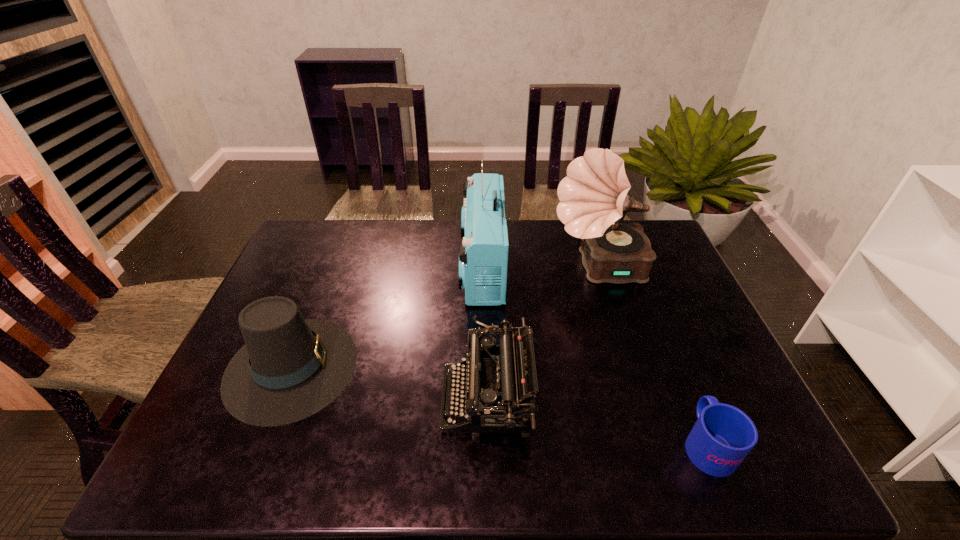
Where is `typewriter positioned at the near edge`? Image resolution: width=960 pixels, height=540 pixels. typewriter positioned at the near edge is located at coordinates (494, 374).

I want to click on mug present at the near edge, so click(x=723, y=435).

You are a GUI agent. You are given a task and a screenshot of the screen. Output one action in this format:
    pyautogui.click(x=<x>, y=<y>)
    Task: Click on the object at the left edge
    Image resolution: width=960 pixels, height=540 pixels.
    Given the screenshot: What is the action you would take?
    pyautogui.click(x=290, y=368)

Locate an element on the screen. record player that is at the right edge is located at coordinates (593, 196).

Image resolution: width=960 pixels, height=540 pixels. I want to click on mug that is at the right edge, so click(723, 435).

Find the location of a particular element. The image size is (960, 540). object that is at the far right corner is located at coordinates (593, 196).

You are a GUI agent. You are given a task and a screenshot of the screen. Output one action in this format:
    pyautogui.click(x=<x>, y=<y>)
    Task: Click on the object situated at the near right corner
    The image size is (960, 540).
    Given the screenshot: What is the action you would take?
    pyautogui.click(x=723, y=435)

At what (x,y) coordinates should I click in order to perform the action: click on free spot at the far edge of the desktop. Please return your answer as a coordinate pair (x, y). This screenshot has width=960, height=540. Looking at the image, I should click on (442, 248).

Where is `free space at the left edge of the desktop`? free space at the left edge of the desktop is located at coordinates point(229,416).

I want to click on free space at the right edge of the desktop, so click(x=687, y=302).